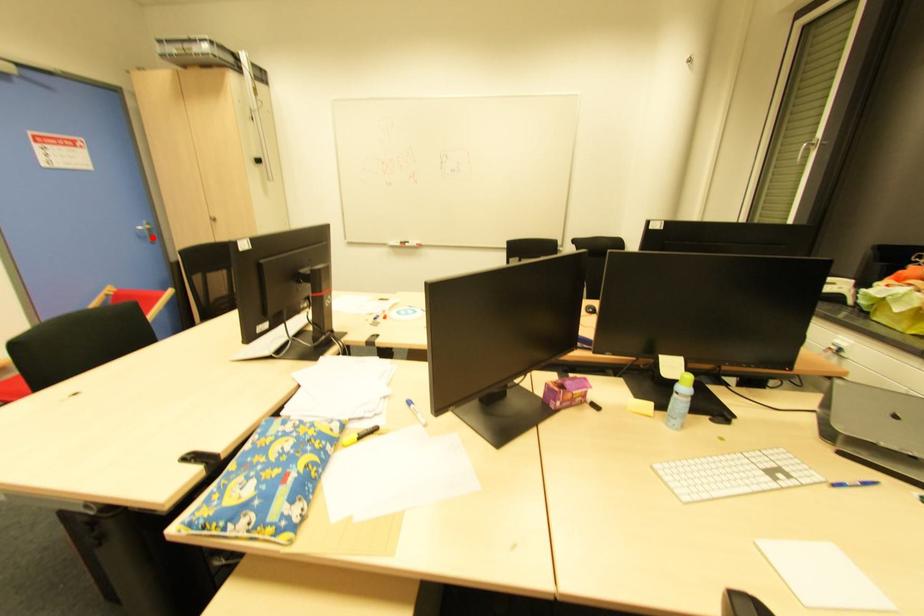
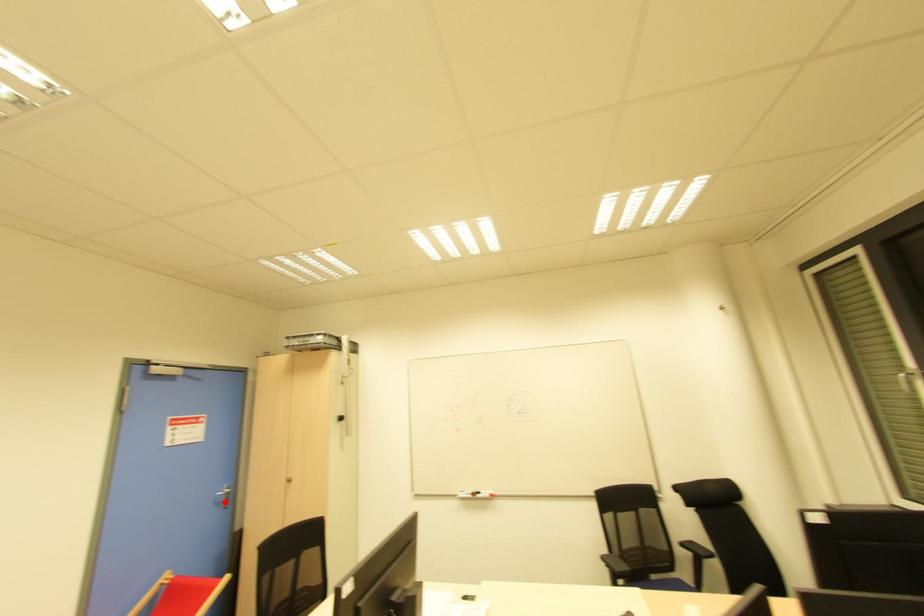
I am providing you with two images of the same scene from different viewpoints. A red point is marked on the first image and another point is marked on the second image. Is the marked point in image1 the same physical position as the marked point in image2?

Yes